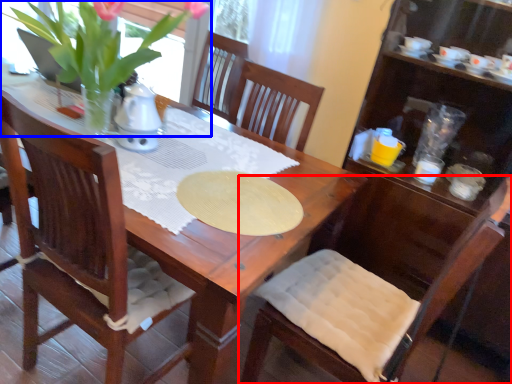
Question: Which of the following is the closest to the observer, chair (highlighted by a red box) or houseplant (highlighted by a blue box)?

Choices:
 (A) chair
 (B) houseplant

Answer: (A)